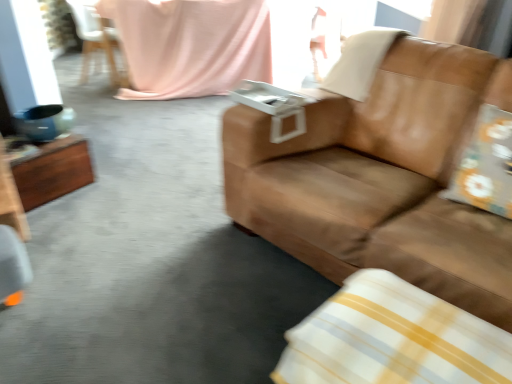
Where is `vacant area on top of white/yellow striped pillow at lower right, which is counted as the third pillow, starting from the back (from a real-world perspective)`? This screenshot has width=512, height=384. vacant area on top of white/yellow striped pillow at lower right, which is counted as the third pillow, starting from the back (from a real-world perspective) is located at coordinates (405, 335).